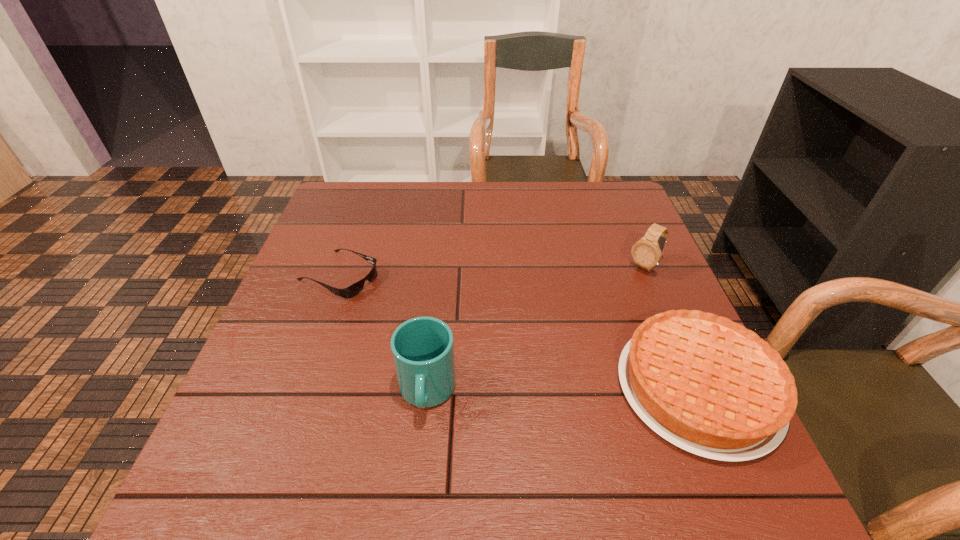
Where is `free space between the pie and the shortest object`? free space between the pie and the shortest object is located at coordinates (518, 332).

Locate which object is the third closest to the cup. Please provide its 2D coordinates. Your answer should be formatted as a tuple, i.e. [(x, y)], where the tuple contains the x and y coordinates of a point satisfying the conditions above.

[(646, 253)]

Identify the location of object that ranks as the closest to the second shortest object. tap(646, 253).

What are the coordinates of `vacant space that satisfies the following two spatial constraints: 1. on the front side of the third tallest object; 2. on the left side of the watch` in the screenshot? It's located at (696, 388).

Where is `free location that satisfies the following two spatial constraints: 1. on the front side of the leftmost object; 2. on the right side of the third tallest object`? Image resolution: width=960 pixels, height=540 pixels. free location that satisfies the following two spatial constraints: 1. on the front side of the leftmost object; 2. on the right side of the third tallest object is located at coordinates (299, 388).